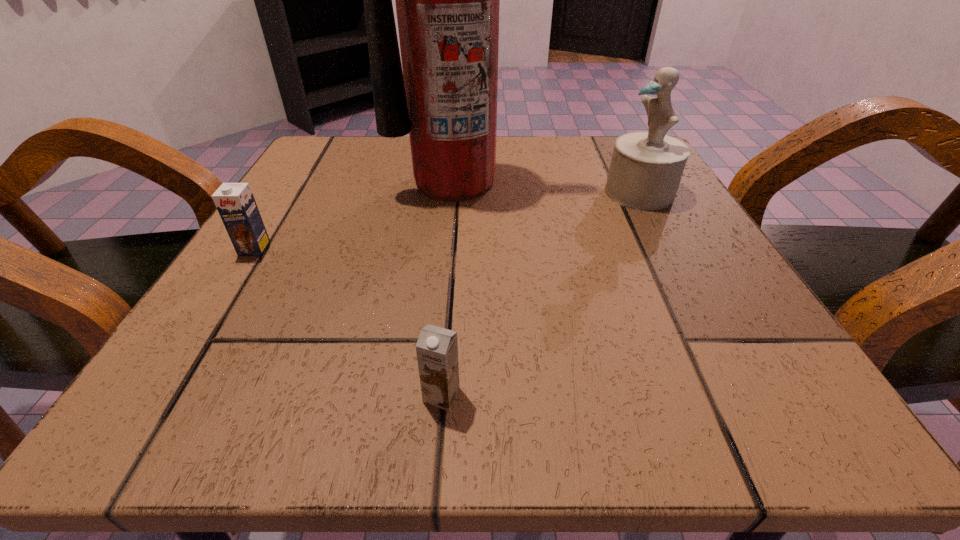
Identify the location of free space in the image that satisfies the following two spatial constraints: 1. on the front of the right chocolate milk near the operation label; 2. on the right side of the fire extinguisher. (435, 395).

Locate an element on the screen. The height and width of the screenshot is (540, 960). free spot that satisfies the following two spatial constraints: 1. at the beak of the rightmost object; 2. on the front label of the farther chocolate milk is located at coordinates (670, 249).

At what (x,y) coordinates should I click in order to perform the action: click on free space in the image that satisfies the following two spatial constraints: 1. at the beak of the rightmost object; 2. on the front side of the nearest object. Please return your answer as a coordinate pair (x, y). This screenshot has width=960, height=540. Looking at the image, I should click on (748, 395).

Find the location of a particular element. The width and height of the screenshot is (960, 540). vacant space that satisfies the following two spatial constraints: 1. at the beak of the figurine; 2. on the front label of the left chocolate milk is located at coordinates (670, 249).